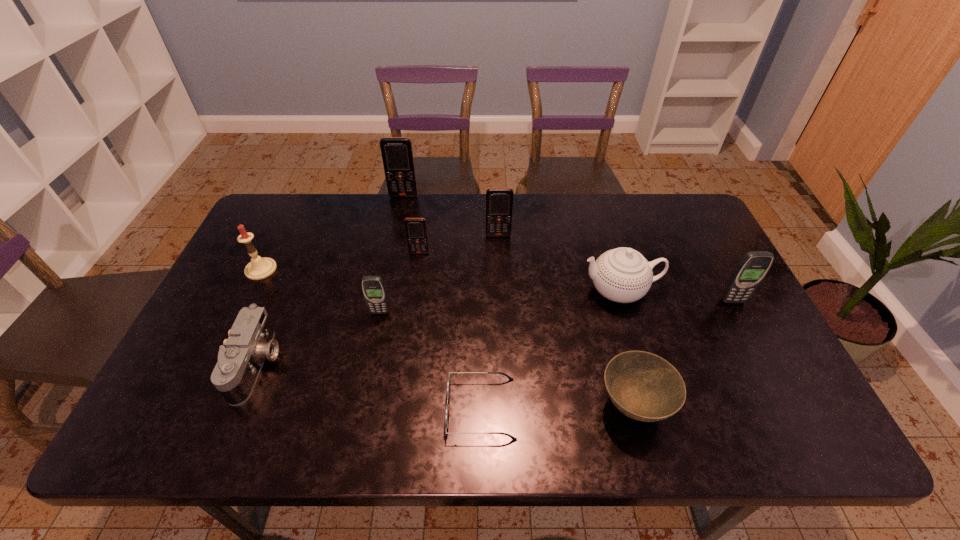
Find the location of a particular element. bowl situated at the near edge is located at coordinates (643, 386).

Locate an element on the screen. Image resolution: width=960 pixels, height=540 pixels. sunglasses that is positioned at the near edge is located at coordinates (448, 384).

Where is `candle that is positioned at the left edge`? The image size is (960, 540). candle that is positioned at the left edge is located at coordinates (259, 268).

Image resolution: width=960 pixels, height=540 pixels. What are the coordinates of `camera that is at the left edge` in the screenshot? It's located at coord(251,340).

The image size is (960, 540). Find the location of `object that is at the right edge`. object that is at the right edge is located at coordinates (753, 267).

Where is `vacant space at the far edge`? vacant space at the far edge is located at coordinates (344, 202).

In the image, there is a desktop. At what (x,y) coordinates should I click in order to perform the action: click on vacant space at the near edge. Please return your answer as a coordinate pair (x, y). The width and height of the screenshot is (960, 540). Looking at the image, I should click on (620, 423).

You are a GUI agent. You are given a task and a screenshot of the screen. Output one action in this format:
    pyautogui.click(x=<x>, y=<y>)
    Task: Click on the blank space at the right edge
    The image size is (960, 540).
    Given the screenshot: What is the action you would take?
    pyautogui.click(x=717, y=319)

Where is `free space between the fourth nearest cellular telephone and the farthest orange cellular telephone`? free space between the fourth nearest cellular telephone and the farthest orange cellular telephone is located at coordinates (451, 215).

This screenshot has height=540, width=960. I want to click on empty location between the rightmost object and the left gray cellular telephone, so click(x=556, y=307).